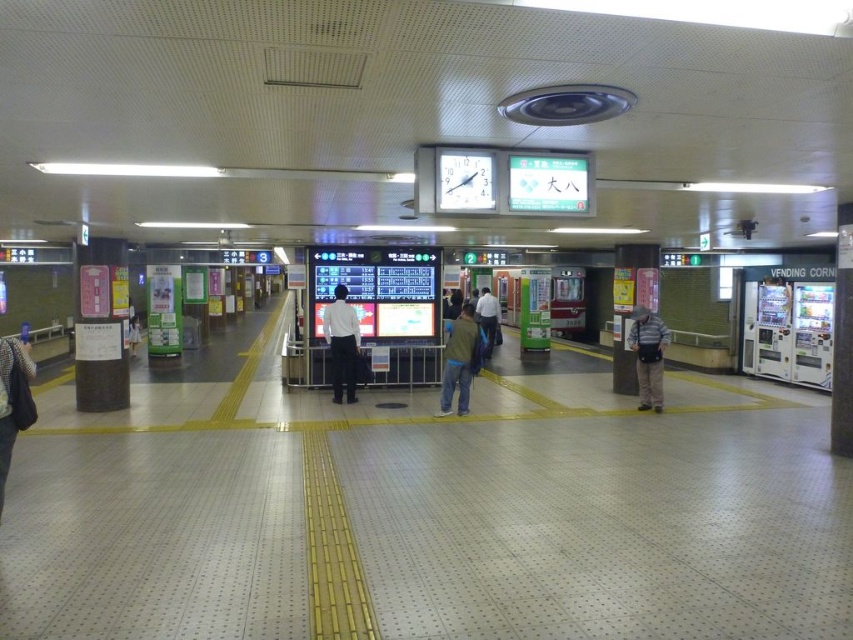
Question: Which of these objects is positioned farthest from the white shirt at center?

Choices:
 (A) blue jeans at center
 (B) striped cotton shirt at center

Answer: (B)

Question: Can you confirm if white shirt at center is positioned to the right of blue jeans at center?

Choices:
 (A) no
 (B) yes

Answer: (A)

Question: Which point appears farthest from the camera in this image?

Choices:
 (A) (20, 394)
 (B) (345, 314)
 (C) (640, 396)
 (D) (491, 349)

Answer: (D)

Question: Is denim jacket at lower left above blue jeans at center?

Choices:
 (A) yes
 (B) no

Answer: (B)

Question: Among these points, which one is nearest to the camera?

Choices:
 (A) (456, 372)
 (B) (337, 403)

Answer: (A)

Question: Does denim jacket at lower left have a greater width compared to white shirt at center?

Choices:
 (A) no
 (B) yes

Answer: (A)